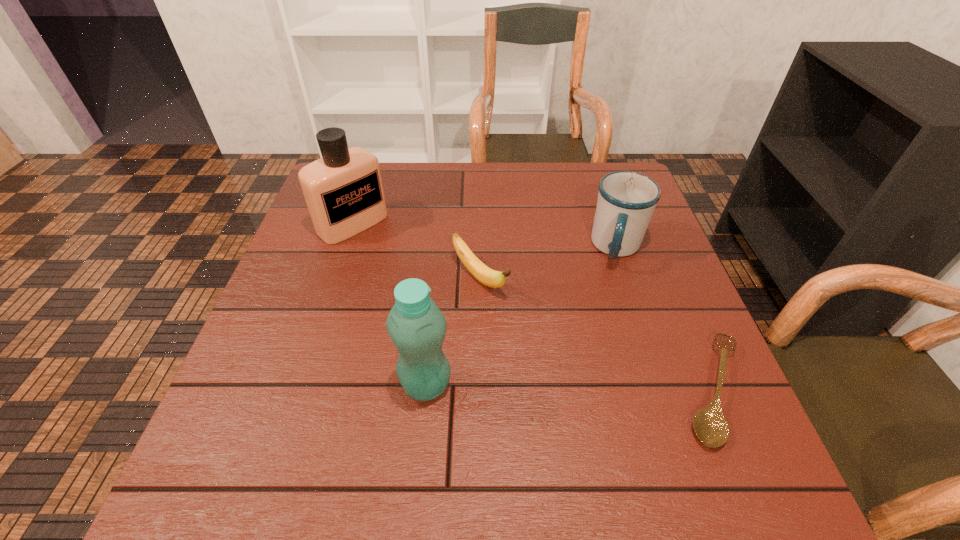
Locate an element on the screen. free space on the desktop that is between the water bottle and the shortest object and is positioned on the front label of the perfume is located at coordinates (551, 387).

This screenshot has height=540, width=960. I want to click on vacant space on the desktop that is between the water bottle and the shortest object and is positioned on the handle side of the third shortest object, so click(606, 388).

The image size is (960, 540). Find the location of `vacant spot on the desktop that is between the water bottle and the shortest object and is positioned at the stem of the fourth tallest object`. vacant spot on the desktop that is between the water bottle and the shortest object and is positioned at the stem of the fourth tallest object is located at coordinates (607, 388).